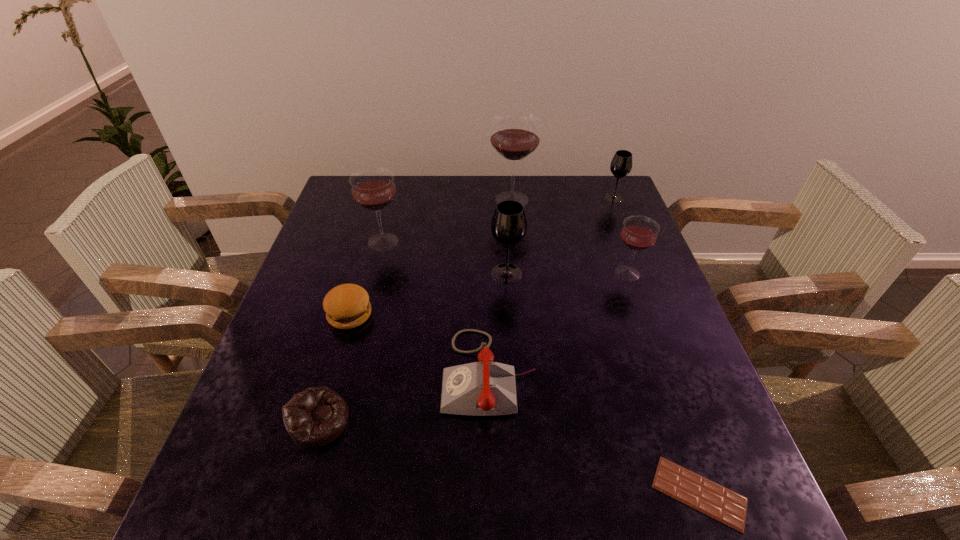
Where is `the tallest object`? the tallest object is located at coordinates (515, 136).

Where is `the biggest red wineglass`? This screenshot has width=960, height=540. the biggest red wineglass is located at coordinates (515, 136).

Locate an element on the screen. This screenshot has width=960, height=540. the second smallest red wineglass is located at coordinates (372, 188).

The image size is (960, 540). I want to click on the seventh nearest object, so click(x=372, y=188).

The image size is (960, 540). Find the location of `the nearer gray wineglass`. the nearer gray wineglass is located at coordinates (509, 225).

Image resolution: width=960 pixels, height=540 pixels. I want to click on the left gray wineglass, so click(509, 225).

Where is `the nearest red wineglass`? Image resolution: width=960 pixels, height=540 pixels. the nearest red wineglass is located at coordinates (639, 233).

At what (x,y) coordinates should I click in order to perform the action: click on the rightmost red wineglass. Please return your answer as a coordinate pair (x, y). Looking at the image, I should click on (639, 233).

The width and height of the screenshot is (960, 540). In order to click on the smaller gray wineglass in this screenshot , I will do `click(621, 164)`.

At what (x,y) coordinates should I click in order to perform the action: click on the right gray wineglass. Please return your answer as a coordinate pair (x, y). The height and width of the screenshot is (540, 960). Looking at the image, I should click on (621, 164).